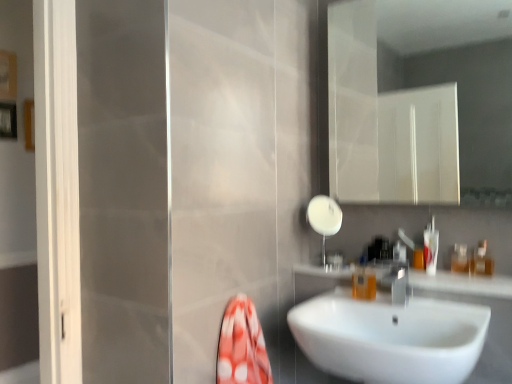
Find the location of a particular element. vacant area that lies in front of translucent plastic container at right, arranged as the second toiletry when viewed from the left is located at coordinates pyautogui.click(x=479, y=279).